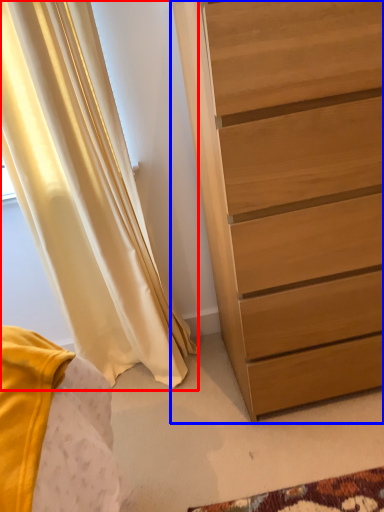
Question: Which of the following is the closest to the observer, curtain (highlighted by a red box) or chest of drawers (highlighted by a blue box)?

Choices:
 (A) curtain
 (B) chest of drawers

Answer: (B)